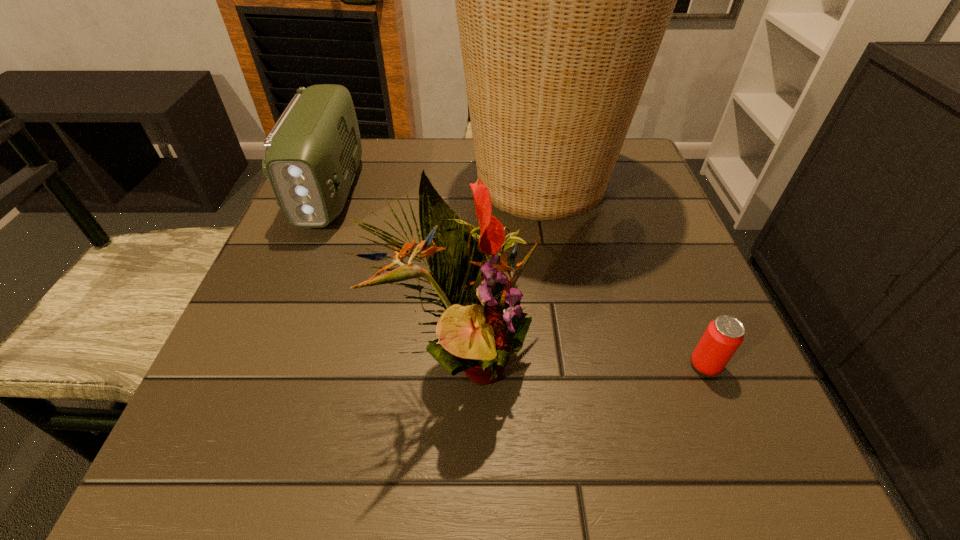
Locate an element on the screen. The image size is (960, 540). the tallest object is located at coordinates (x=562, y=0).

This screenshot has height=540, width=960. I want to click on bouquet, so click(x=483, y=323).

Identify the location of radio_receiver. The height and width of the screenshot is (540, 960). (313, 151).

You are a GUI agent. You are given a task and a screenshot of the screen. Output one action in this format:
    pyautogui.click(x=<x>, y=<y>)
    Task: Click on the third tallest object
    The width and height of the screenshot is (960, 540).
    Given the screenshot: What is the action you would take?
    pyautogui.click(x=313, y=151)

The height and width of the screenshot is (540, 960). What are the coordinates of `beer can` in the screenshot? It's located at (723, 336).

Where is `vacant space positioned on the front of the basket`? vacant space positioned on the front of the basket is located at coordinates pos(563,306).

Find the location of a particular element. The width and height of the screenshot is (960, 540). vacant space positioned 0.120m on the front-facing side of the bouquet is located at coordinates (618, 357).

Where is `vacant space located 0.290m on the front-facing side of the leftmost object`? The image size is (960, 540). vacant space located 0.290m on the front-facing side of the leftmost object is located at coordinates (262, 359).

The image size is (960, 540). What are the coordinates of `vacant region located 0.210m on the back of the shortest object` in the screenshot? It's located at (661, 259).

Identify the location of basket located at the far edge. Image resolution: width=960 pixels, height=540 pixels. (562, 0).